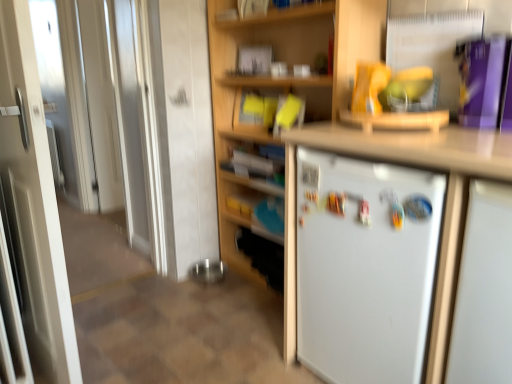
Question: From a real-world perspective, is white matte refrigerator at center above or below white glossy door at left?

Choices:
 (A) above
 (B) below

Answer: (B)

Question: Is point (473, 309) positioned closer to the camera than point (4, 125)?

Choices:
 (A) closer
 (B) farther

Answer: (A)

Question: Which object is the closest to the white glossy door at left?

Choices:
 (A) white matte refrigerator at center
 (B) beige tile at lower center
 (C) white matte refrigerator at right
 (D) white glossy door at left
 (E) wooden bookshelf at center

Answer: (B)

Question: Which object is the farthest from the white matte refrigerator at center?

Choices:
 (A) wooden bookshelf at center
 (B) white glossy door at left
 (C) white matte refrigerator at right
 (D) white glossy door at left
 (E) beige tile at lower center

Answer: (D)